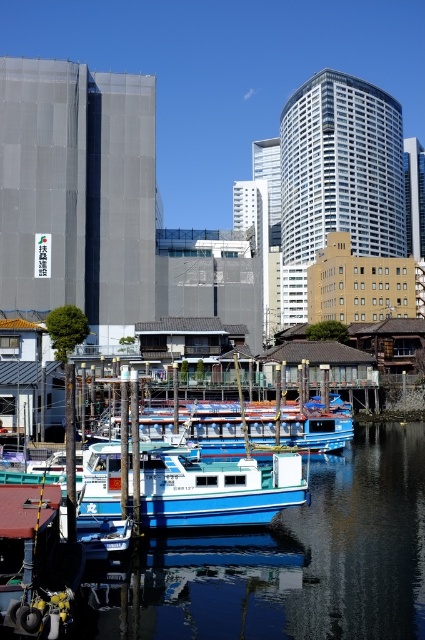
Between blue glossy boat at center and blue matte boat at center, which one is positioned higher?

blue matte boat at center

Does blue glossy boat at center appear over blue matte boat at center?

No.

Identify the location of blue glossy boat at center. (291, 561).

Does point (266, 508) come behind point (226, 428)?

No, it is not.

Does blue matte boat at center appear over blue wooden boat at center?

Actually, blue matte boat at center is below blue wooden boat at center.

You are a GUI agent. You are given a task and a screenshot of the screen. Output one action in this format:
    pyautogui.click(x=<x>, y=<y>)
    Task: Click on the blue matte boat at center
    
    Given the screenshot: What is the action you would take?
    pyautogui.click(x=215, y=488)

Find the location of a particular element. blue matte boat at center is located at coordinates (215, 488).

Can you confirm if blue glossy boat at center is thinner than blue wooden boat at center?

Indeed, blue glossy boat at center has a lesser width compared to blue wooden boat at center.

Based on the photo, does blue glossy boat at center appear on the left side of blue wooden boat at center?

No, blue glossy boat at center is not to the left of blue wooden boat at center.

Is point (303, 550) less distant than point (161, 429)?

Yes, point (303, 550) is closer to viewer.

Locate an element on the screen. This screenshot has width=425, height=640. blue glossy boat at center is located at coordinates (291, 561).